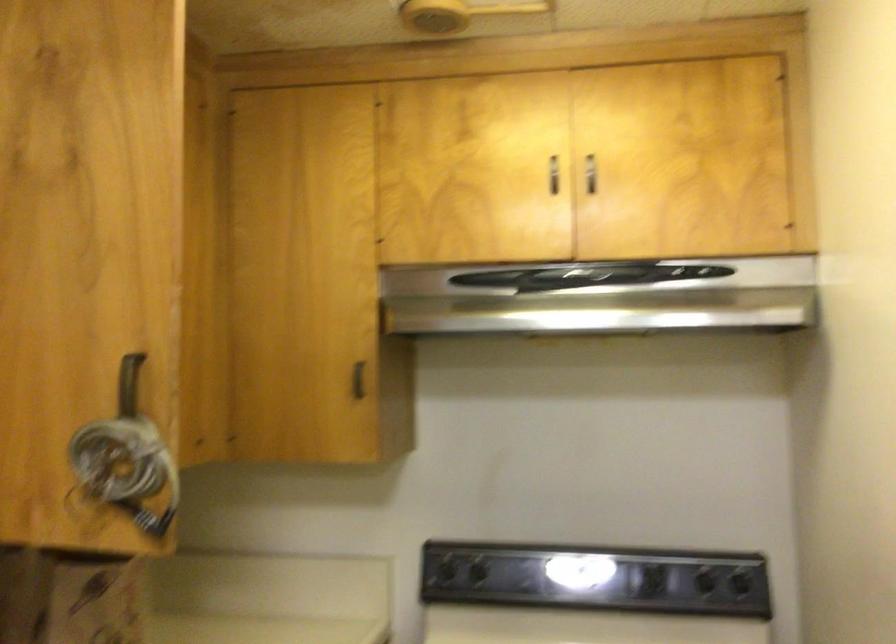
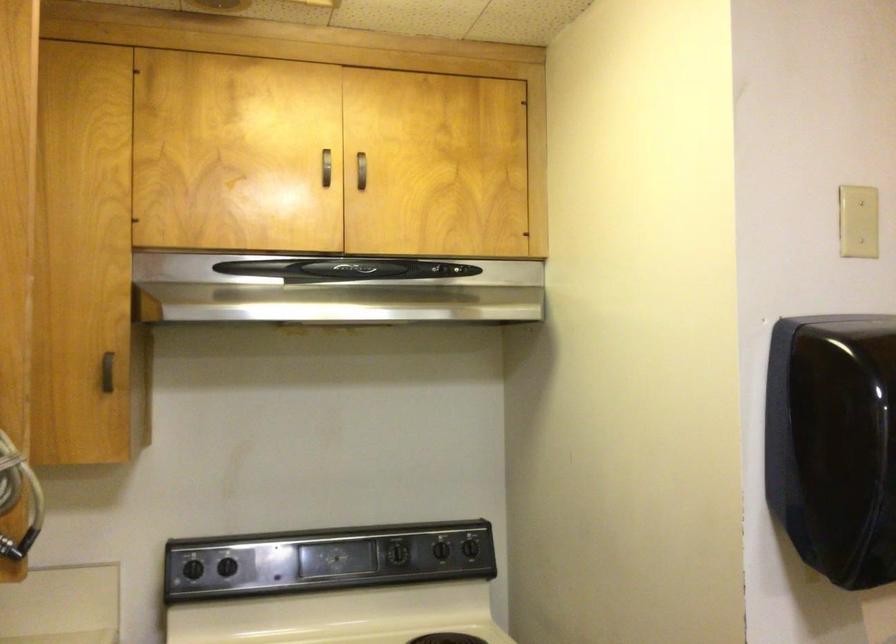
Find the pixel in the second image that matches [556,169] in the first image.

(325, 167)